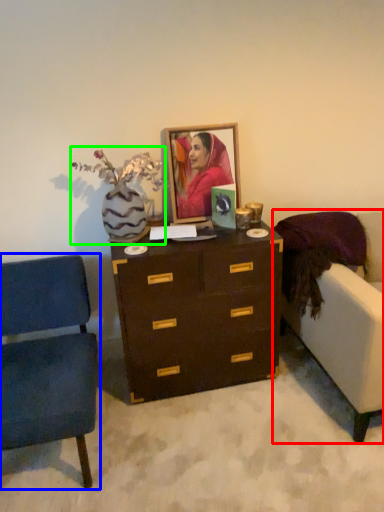
Question: Which object is the closest to the studio couch (highlighted by a red box)? Choose among these: chair (highlighted by a blue box) or floral arrangement (highlighted by a green box).

Choices:
 (A) chair
 (B) floral arrangement

Answer: (B)